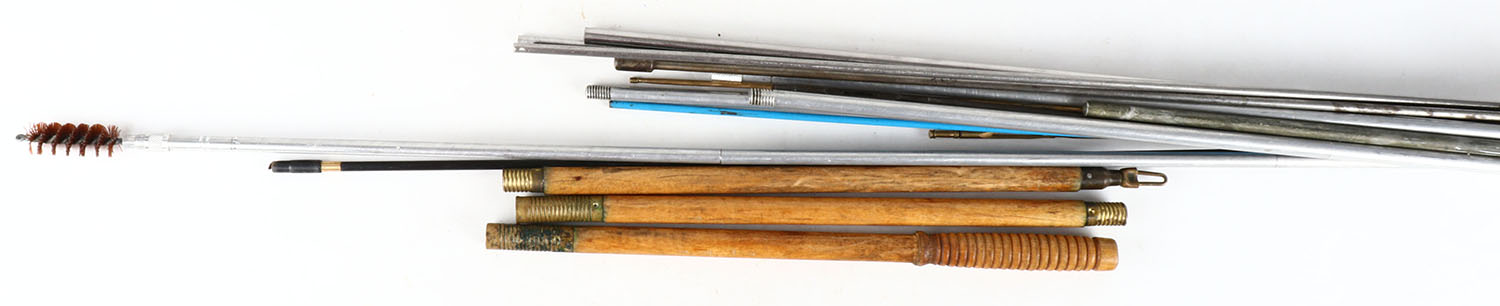
Identify the location of steel handles. This screenshot has height=306, width=1500. click(x=876, y=107), click(x=1120, y=108), click(x=828, y=64), click(x=646, y=34).